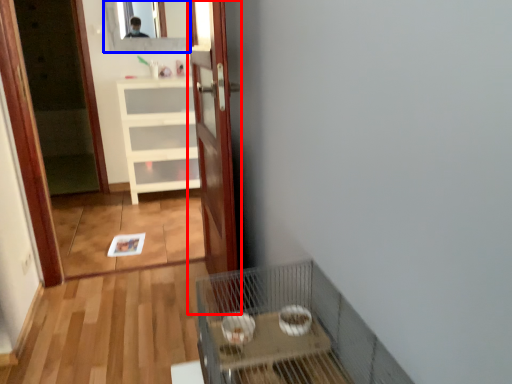
Question: Which point is further to the camera, door (highlighted by a red box) or mirror (highlighted by a blue box)?

Choices:
 (A) door
 (B) mirror

Answer: (B)